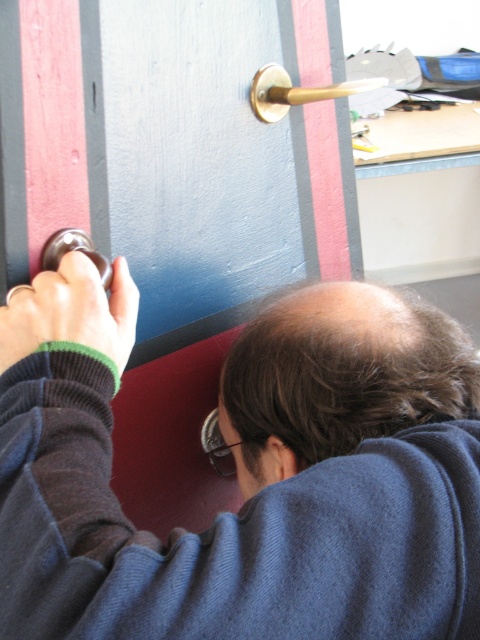
Looking at this image, which of these two, dark blue sweater at center or polished brass door handle at upper left, stands shorter?

With less height is polished brass door handle at upper left.

Between point (27, 324) and point (75, 244), which one is positioned in front?

Positioned in front is point (27, 324).

From the picture: Measure the distance between point (284, 436) and camera.

Point (284, 436) and camera are 22.01 inches apart from each other.

What are the coordinates of `dark blue sweater at center` in the screenshot? It's located at point(245,474).

Does gold polished door handle at upper center have a greater height compared to polished brass door handle at upper left?

Correct, gold polished door handle at upper center is much taller as polished brass door handle at upper left.

Where is `gold polished door handle at upper center`? gold polished door handle at upper center is located at coordinates coord(297,92).

The width and height of the screenshot is (480, 640). I want to click on gold polished door handle at upper center, so click(x=297, y=92).

Can you confirm if green knitted wristband at lower left is positioned above polished brass door handle at upper left?

No, green knitted wristband at lower left is not above polished brass door handle at upper left.

Between point (11, 339) and point (43, 253), which one is positioned in front?

Point (11, 339) is more forward.

Identify the location of green knitted wristband at lower left. (72, 310).